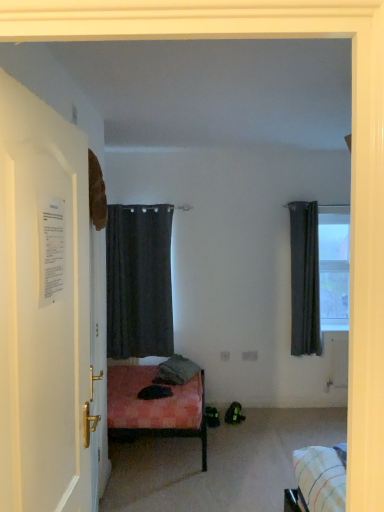
The image size is (384, 512). In order to click on dark gray fabric curtain at right, the 2th curtain when ordered from left to right in this screenshot , I will do (305, 279).

What do you see at coordinates (334, 267) in the screenshot? I see `transparent glass window at upper right` at bounding box center [334, 267].

The width and height of the screenshot is (384, 512). I want to click on white paper at left, so click(x=43, y=308).

What's the angular difference between white paper at left and transparent glass window at upper right's facing directions?

The angular difference between white paper at left and transparent glass window at upper right is 87.8 degrees.

Is white paper at left oriented towards transparent glass window at upper right?

No, white paper at left is not oriented towards transparent glass window at upper right.

Is white paper at left outside of transparent glass window at upper right?

Indeed, white paper at left is completely outside transparent glass window at upper right.

Based on the photo, from the image's perspective, does white paper at left appear lower than transparent glass window at upper right?

Yes.

Does dark gray fabric curtain at right, which is the first curtain from right to left, have a lesser height compared to transparent glass window at upper right?

In fact, dark gray fabric curtain at right, which is the first curtain from right to left, may be taller than transparent glass window at upper right.

Who is more distant, dark gray fabric curtain at right, the 2th curtain when ordered from left to right, or transparent glass window at upper right?

transparent glass window at upper right.

Does dark gray fabric curtain at right, the 2th curtain when ordered from left to right, appear on the right side of transparent glass window at upper right?

No.

Based on the photo, would you say dark gray fabric curtain at right, which is the first curtain from right to left, is outside transparent glass window at upper right?

dark gray fabric curtain at right, which is the first curtain from right to left, is positioned outside transparent glass window at upper right.

Who is smaller, transparent glass window at upper right or white paper at left?

Smaller between the two is transparent glass window at upper right.

Considering the relative sizes of transparent glass window at upper right and white paper at left in the image provided, is transparent glass window at upper right wider than white paper at left?

Incorrect, the width of transparent glass window at upper right does not surpass that of white paper at left.

You are a GUI agent. You are given a task and a screenshot of the screen. Output one action in this format:
    pyautogui.click(x=<x>, y=<y>)
    Task: Click on the door that appears in front of the transparent glass window at upper right
    Image resolution: width=384 pixels, height=512 pixels.
    Given the screenshot: What is the action you would take?
    pyautogui.click(x=43, y=308)

Which object is further away from the camera, white paper at left or dark gray fabric curtain at right, which is the first curtain from right to left?

dark gray fabric curtain at right, which is the first curtain from right to left, is behind.

Is there a large distance between white paper at left and dark gray fabric curtain at right, the 2th curtain when ordered from left to right?

That's right, there is a large distance between white paper at left and dark gray fabric curtain at right, the 2th curtain when ordered from left to right.

Is white paper at left facing towards dark gray fabric curtain at right, the 2th curtain when ordered from left to right?

No, white paper at left is not turned towards dark gray fabric curtain at right, the 2th curtain when ordered from left to right.

In terms of height, does gray fabric pillow at center look taller or shorter compared to white paper at left?

Considering their sizes, gray fabric pillow at center has less height than white paper at left.

From a real-world perspective, who is located higher, gray fabric pillow at center or white paper at left?

In real-world perspective, white paper at left is above.

Is point (184, 357) closer to viewer compared to point (23, 208)?

No.

The height and width of the screenshot is (512, 384). Find the location of `door in front of the gray fabric pillow at center`. door in front of the gray fabric pillow at center is located at coordinates (43, 308).

Based on their sizes in the image, would you say gray fabric pillow at center is bigger or smaller than transparent glass window at upper right?

In the image, gray fabric pillow at center appears to be larger than transparent glass window at upper right.

Is gray fabric pillow at center completely or partially outside of transparent glass window at upper right?

Indeed, gray fabric pillow at center is completely outside transparent glass window at upper right.

Considering their positions, is gray fabric pillow at center located in front of or behind transparent glass window at upper right?

In the image, gray fabric pillow at center appears in front of transparent glass window at upper right.

Looking at this image, from the image's perspective, relative to transparent glass window at upper right, is dark matte curtain at center, which is the first curtain in left-to-right order, above or below?

From the image's perspective, dark matte curtain at center, which is the first curtain in left-to-right order, appears below transparent glass window at upper right.

From a real-world perspective, is dark matte curtain at center, which is the first curtain in left-to-right order, physically above transparent glass window at upper right?

No, from a real-world perspective, dark matte curtain at center, which is the first curtain in left-to-right order, is not on top of transparent glass window at upper right.

Consider the image. In the image, is dark matte curtain at center, which is the first curtain in left-to-right order, positioned in front of or behind transparent glass window at upper right?

Visually, dark matte curtain at center, which is the first curtain in left-to-right order, is located in front of transparent glass window at upper right.

Is dark matte curtain at center, which is the first curtain in left-to-right order, next to transparent glass window at upper right?

They are not placed beside each other.

This screenshot has width=384, height=512. I want to click on window behind the white paper at left, so click(334, 267).

At what (x,y) coordinates should I click in order to perform the action: click on window that appears above the dark gray fabric curtain at right, which is the first curtain from right to left (from a real-world perspective). Please return your answer as a coordinate pair (x, y). The width and height of the screenshot is (384, 512). Looking at the image, I should click on (334, 267).

Estimate the real-world distances between objects in this image. Which object is further from dark matte curtain at center, arranged as the 2th curtain when viewed from the right, transparent glass window at upper right or dark gray fabric curtain at right, the 2th curtain when ordered from left to right?

transparent glass window at upper right is further to dark matte curtain at center, arranged as the 2th curtain when viewed from the right.

When comparing their distances from dark matte curtain at center, which is the first curtain in left-to-right order, does white paper at left or transparent glass window at upper right seem closer?

transparent glass window at upper right lies closer to dark matte curtain at center, which is the first curtain in left-to-right order, than the other object.

From the image, which object appears to be nearer to white paper at left, transparent glass window at upper right or dark matte curtain at center, which is the first curtain in left-to-right order?

Among the two, dark matte curtain at center, which is the first curtain in left-to-right order, is located nearer to white paper at left.

Estimate the real-world distances between objects in this image. Which object is closer to dark matte curtain at center, arranged as the 2th curtain when viewed from the right, white paper at left or dark gray fabric curtain at right, which is the first curtain from right to left?

dark gray fabric curtain at right, which is the first curtain from right to left, is positioned closer to the anchor dark matte curtain at center, arranged as the 2th curtain when viewed from the right.

Estimate the real-world distances between objects in this image. Which object is closer to dark gray fabric curtain at right, which is the first curtain from right to left, transparent glass window at upper right or dark matte curtain at center, arranged as the 2th curtain when viewed from the right?

transparent glass window at upper right is positioned closer to the anchor dark gray fabric curtain at right, which is the first curtain from right to left.

From the image, which object appears to be farther from dark matte curtain at center, arranged as the 2th curtain when viewed from the right, dark gray fabric curtain at right, the 2th curtain when ordered from left to right, or gray fabric pillow at center?

The object further to dark matte curtain at center, arranged as the 2th curtain when viewed from the right, is dark gray fabric curtain at right, the 2th curtain when ordered from left to right.

Estimate the real-world distances between objects in this image. Which object is further from white paper at left, dark matte curtain at center, which is the first curtain in left-to-right order, or dark gray fabric curtain at right, which is the first curtain from right to left?

dark gray fabric curtain at right, which is the first curtain from right to left, lies further to white paper at left than the other object.

Considering their positions, is dark gray fabric curtain at right, which is the first curtain from right to left, positioned closer to white paper at left than gray fabric pillow at center?

The object closer to white paper at left is gray fabric pillow at center.

You are a GUI agent. You are given a task and a screenshot of the screen. Output one action in this format:
    pyautogui.click(x=<x>, y=<y>)
    Task: Click on the pillow located between white paper at left and dark matte curtain at center, which is the first curtain in left-to-right order, in the depth direction
    Image resolution: width=384 pixels, height=512 pixels.
    Given the screenshot: What is the action you would take?
    pyautogui.click(x=176, y=371)

Locate an element on the screen. pillow positioned between white paper at left and dark gray fabric curtain at right, the 2th curtain when ordered from left to right, from near to far is located at coordinates (176, 371).

Identify the location of pillow between white paper at left and transparent glass window at upper right from front to back. (176, 371).

Where is `curtain situated between dark matte curtain at center, which is the first curtain in left-to-right order, and transparent glass window at upper right from left to right`? The image size is (384, 512). curtain situated between dark matte curtain at center, which is the first curtain in left-to-right order, and transparent glass window at upper right from left to right is located at coordinates (305, 279).